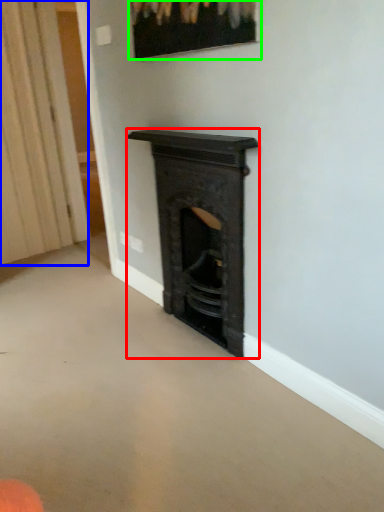
Question: Estimate the real-world distances between objects in this image. Which object is closer to fireplace (highlighted by a red box), curtain (highlighted by a blue box) or picture frame (highlighted by a green box)?

Choices:
 (A) curtain
 (B) picture frame

Answer: (B)